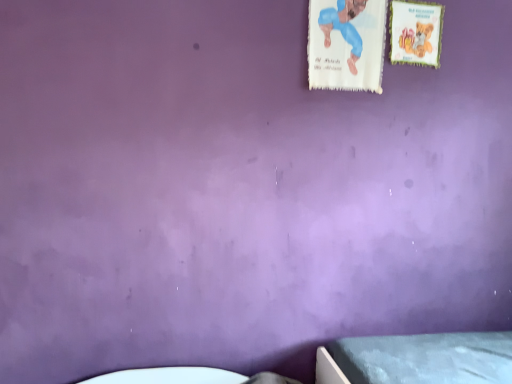
Image resolution: width=512 pixels, height=384 pixels. What do you see at coordinates (415, 32) in the screenshot?
I see `matte paper poster at upper center` at bounding box center [415, 32].

Identify the location of matte paper poster at upper center. (415, 32).

Locate an element on the screen. matte paper poster at upper center is located at coordinates (415, 32).